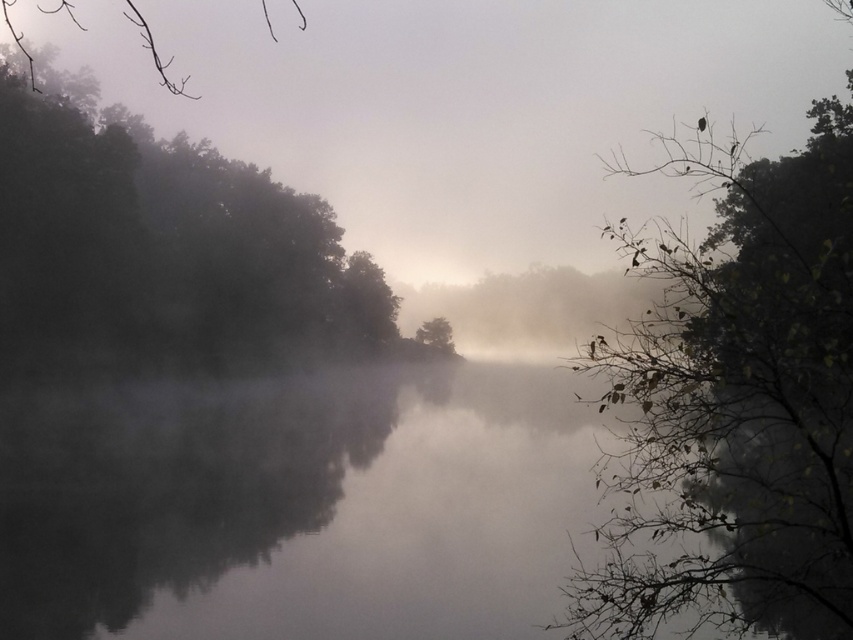
Can you confirm if dark green leafy tree at left is positioned to the right of green matte tree at center?

No, dark green leafy tree at left is not to the right of green matte tree at center.

Image resolution: width=853 pixels, height=640 pixels. Describe the element at coordinates (166, 250) in the screenshot. I see `dark green leafy tree at left` at that location.

Is point (144, 358) positioned in front of point (445, 320)?

Yes, it is in front of point (445, 320).

You are a GUI agent. You are given a task and a screenshot of the screen. Output one action in this format:
    pyautogui.click(x=<x>, y=<y>)
    Task: Click on the dark green leafy tree at left
    The image size is (853, 640).
    Given the screenshot: What is the action you would take?
    pyautogui.click(x=166, y=250)

Is foggy water at center bigger than green matte tree at center?

Correct, foggy water at center is larger in size than green matte tree at center.

Between point (131, 474) and point (439, 317), which one is positioned in front?

Point (131, 474)

Between point (519, 593) and point (444, 323), which one is positioned behind?

Positioned behind is point (444, 323).

Where is `foggy water at center`? foggy water at center is located at coordinates (296, 508).

Between foggy water at center and dark green leafy tree at left, which one has more height?

dark green leafy tree at left

Is foggy water at center bigger than dark green leafy tree at left?

No, foggy water at center is not bigger than dark green leafy tree at left.

Between point (35, 557) and point (131, 189), which one is positioned in front?

Point (35, 557) is more forward.

Where is `foggy water at center`? foggy water at center is located at coordinates (296, 508).